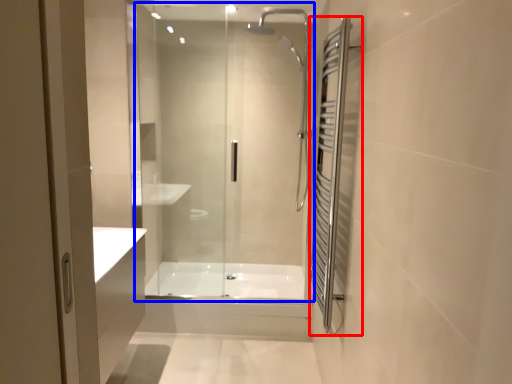
Question: Which object appears farthest to the camera in this image, screen door (highlighted by a red box) or shower door (highlighted by a blue box)?

Choices:
 (A) screen door
 (B) shower door

Answer: (B)